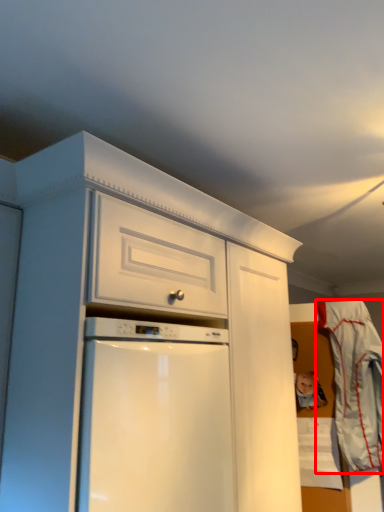
Question: From the image's perspective, what is the correct spatial relationship of laundry (annotated by the red box) in relation to toy?

Choices:
 (A) below
 (B) above

Answer: (A)